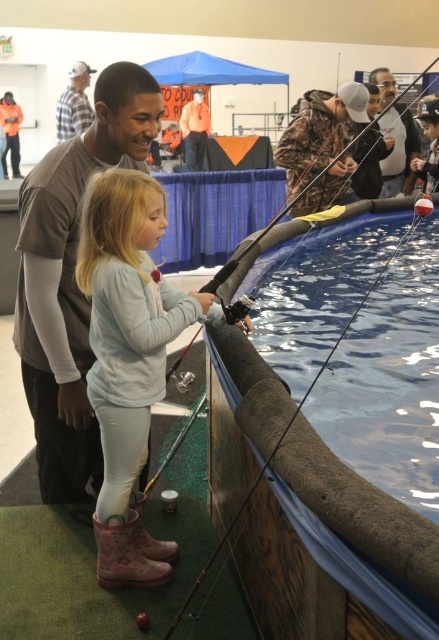
Question: Estimate the real-world distances between objects in this image. Which object is closer to the orange shirt at upper center?

Choices:
 (A) pink rubber boots at lower left
 (B) brushed metal jacket at upper left

Answer: (B)

Question: Can you confirm if matte brown shirt at upper left is positioned above wooden fishing rod at center?

Choices:
 (A) no
 (B) yes

Answer: (B)

Question: Which object is positioned closest to the wooden fishing rod at center?

Choices:
 (A) matte brown shirt at upper left
 (B) pink rubber boots at lower left
 (C) orange shirt at upper center
 (D) camouflage jacket at upper right

Answer: (B)

Question: Where is matte brown shirt at upper left located in relation to striped cotton shirt at upper left in the image?

Choices:
 (A) right
 (B) left

Answer: (A)

Question: Among these points, which one is nearest to the camera?

Choices:
 (A) (104, 556)
 (B) (399, 176)
 (C) (65, 198)
 (D) (190, 132)

Answer: (C)

Question: Observing the image, what is the correct spatial positioning of wooden fishing rod at center in reference to brushed metal jacket at upper left?

Choices:
 (A) above
 (B) below

Answer: (B)